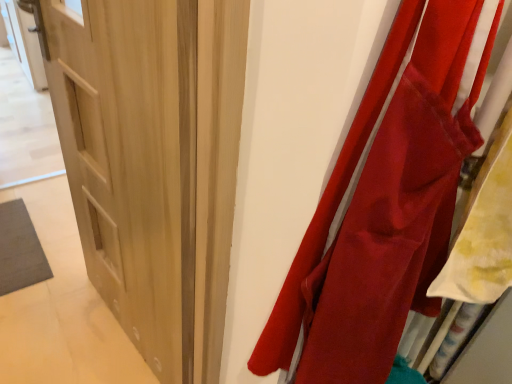
Question: From the image's perspective, relative to light wood door at center, is matte red fabric at right above or below?

Choices:
 (A) below
 (B) above

Answer: (A)

Question: Relative to light wood door at center, is matte red fabric at right in front or behind?

Choices:
 (A) behind
 (B) front

Answer: (B)

Question: From a real-world perspective, relative to light wood door at center, is matte red fabric at right vertically above or below?

Choices:
 (A) below
 (B) above

Answer: (B)

Question: Is point (111, 213) closer or farther from the camera than point (306, 359)?

Choices:
 (A) farther
 (B) closer

Answer: (A)

Question: Considering the relative positions of light wood door at center and matte red fabric at right in the image provided, is light wood door at center to the left or to the right of matte red fabric at right?

Choices:
 (A) right
 (B) left

Answer: (B)

Question: In terms of size, does light wood door at center appear bigger or smaller than matte red fabric at right?

Choices:
 (A) big
 (B) small

Answer: (A)

Question: Is light wood door at center wider or thinner than matte red fabric at right?

Choices:
 (A) wide
 (B) thin

Answer: (B)